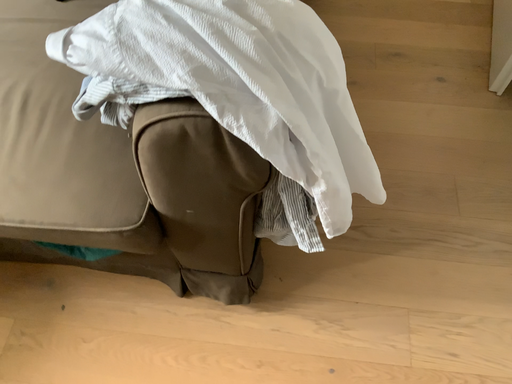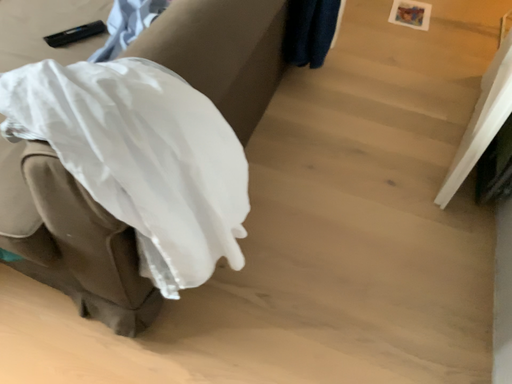
Question: Which way did the camera rotate in the video?

Choices:
 (A) rotated upward
 (B) rotated downward

Answer: (A)